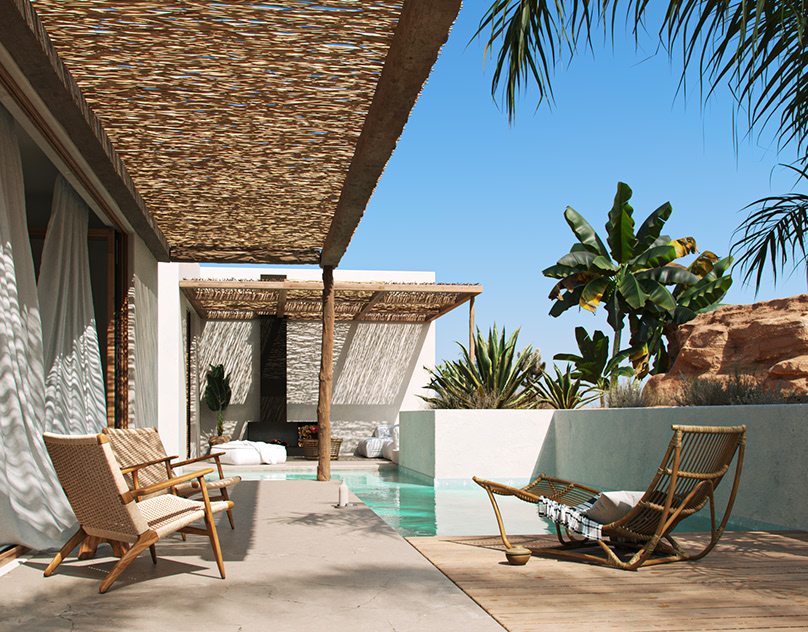
At what (x,y) coordinates should I click in order to perform the action: click on flooring to the left side. Please return your answer as a coordinate pair (x, y). Looking at the image, I should click on (303, 578).